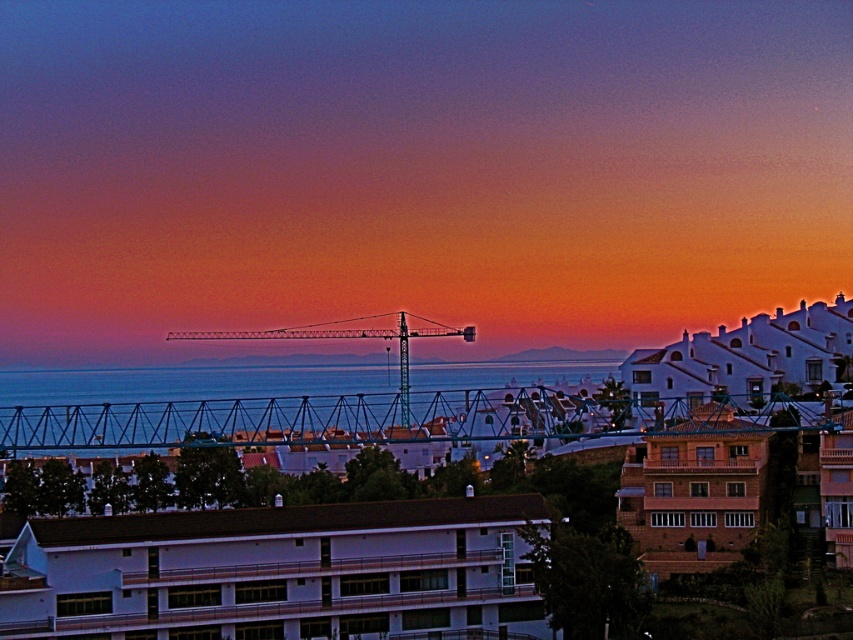
Question: From the image, what is the correct spatial relationship of blue water at center in relation to teal metallic crane at center?

Choices:
 (A) right
 (B) left

Answer: (A)

Question: Which point appears farthest from the camera in this image?

Choices:
 (A) (77, 385)
 (B) (172, 339)

Answer: (B)

Question: Considering the relative positions of blue water at center and teal metallic crane at center in the image provided, where is blue water at center located with respect to teal metallic crane at center?

Choices:
 (A) left
 (B) right

Answer: (B)

Question: Can you confirm if blue water at center is bigger than teal metallic crane at center?

Choices:
 (A) no
 (B) yes

Answer: (B)

Question: Which point appears closest to the camera in this image?

Choices:
 (A) (407, 348)
 (B) (308, 376)

Answer: (A)